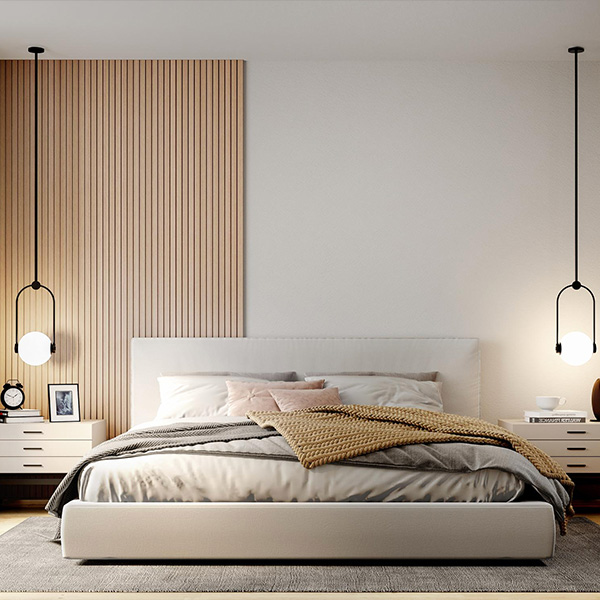
Locate an element on the screen. bedroom is located at coordinates (366, 280).